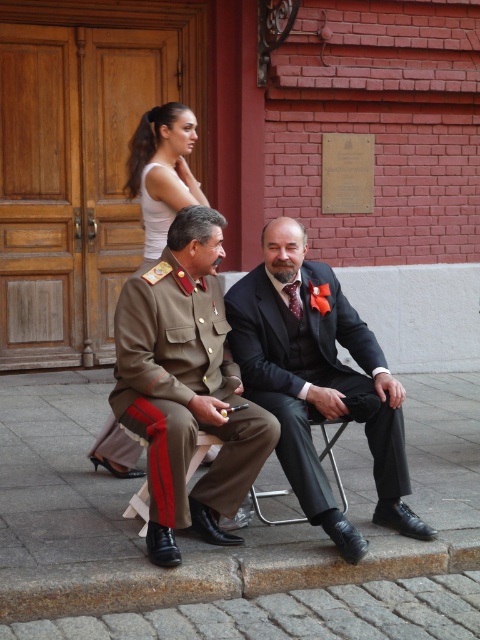
Based on the scene description, which object is taller between the matte brown uniform at center and the white tank top at upper center?

The matte brown uniform at center is taller than the white tank top at upper center.

You are planning to rent a costume for a historical reenactment event. You see the matte brown uniform at center and the white fabric dress at upper center in the image. Based on their sizes, which costume would be more suitable for a taller person?

The matte brown uniform at center has a larger size compared to the white fabric dress at upper center, so it would be more suitable for a taller person.

You are a photographer positioned in front of the red brick building. You want to take a photo that includes both the matte brown uniform at center and the white fabric dress at upper center. Which object should you adjust your camera focus to first to ensure both are in frame?

The matte brown uniform at center is closer to the viewer than the white fabric dress at upper center, so you should focus on the matte brown uniform at center first to ensure depth of field captures both objects.